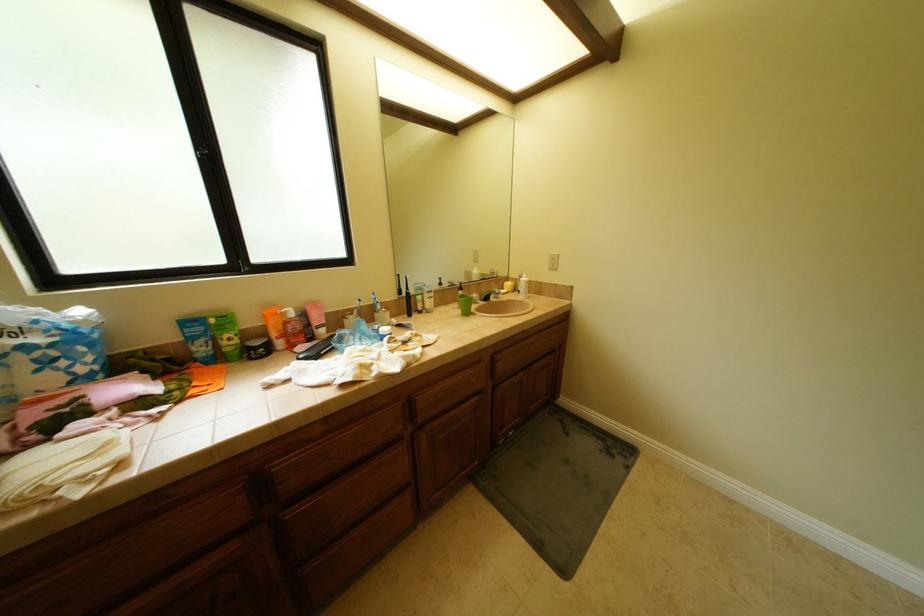
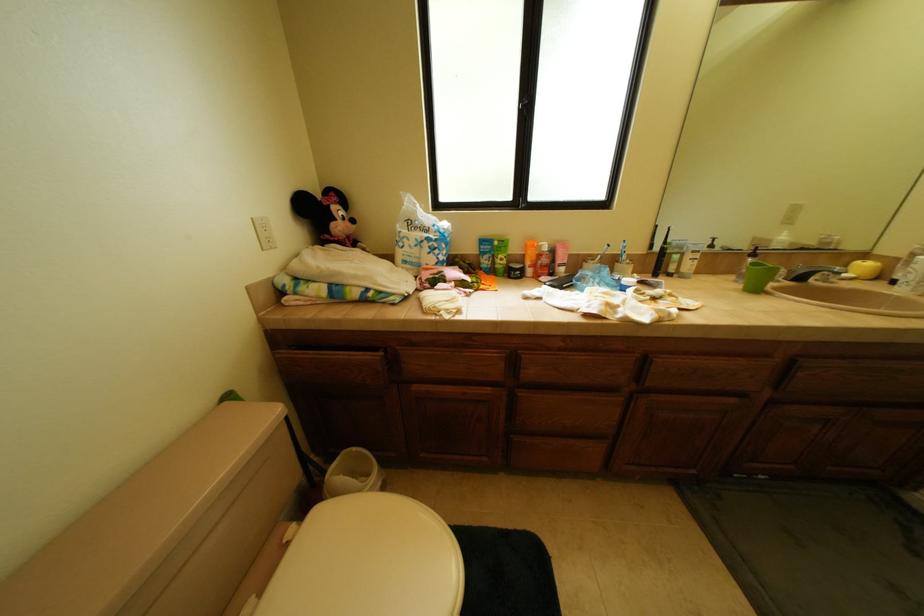
Question: The first image is from the beginning of the video and the second image is from the end. How did the camera likely rotate when shooting the video?

Choices:
 (A) Left
 (B) Right
 (C) Up
 (D) Down

Answer: (A)